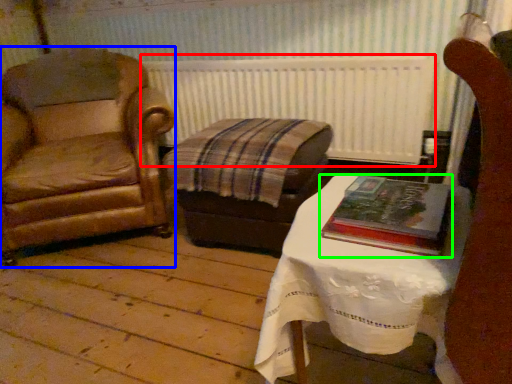
Question: Which object is the farthest from radiator (highlighted by a red box)? Choose among these: chair (highlighted by a blue box) or book (highlighted by a green box).

Choices:
 (A) chair
 (B) book

Answer: (B)